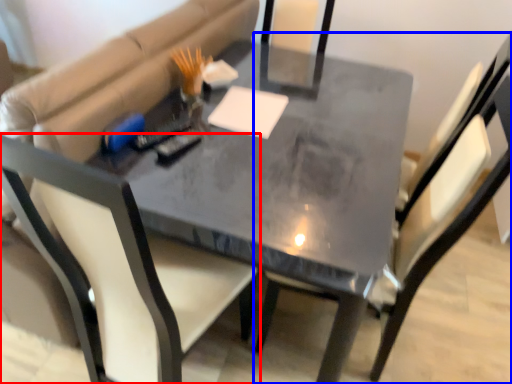
Question: Which point is further to the camera, chair (highlighted by a red box) or chair (highlighted by a blue box)?

Choices:
 (A) chair
 (B) chair

Answer: (A)